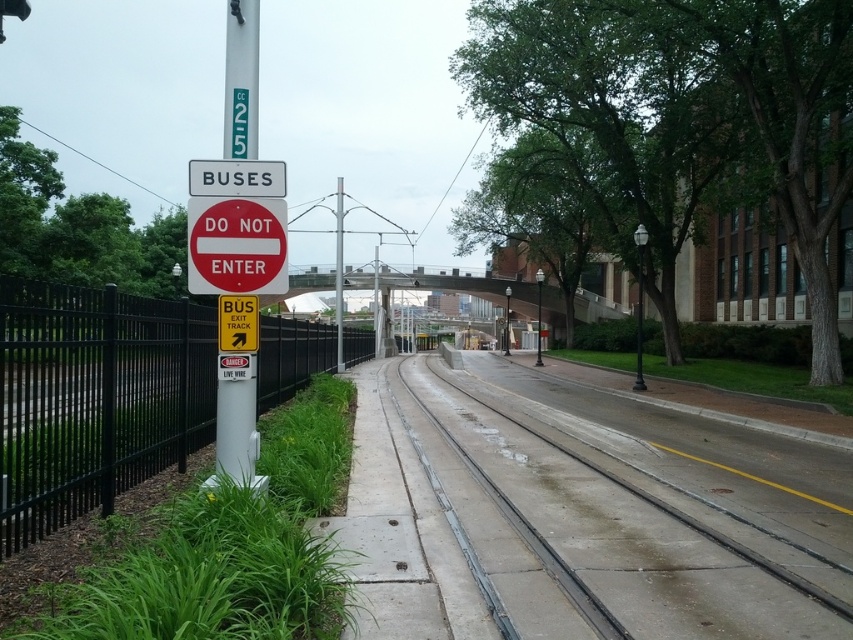
Which of these two, red matte do not enter sign at upper left or metallic pole at center, stands taller?

Standing taller between the two is metallic pole at center.

Which is in front, point (250, 275) or point (639, 298)?

Point (250, 275) is in front.

Is point (279, 228) farther from viewer compared to point (637, 324)?

No, it is in front of (637, 324).

Locate an element on the screen. red matte do not enter sign at upper left is located at coordinates (236, 244).

Between red matte do not enter sign at upper left and white plastic pole at center, which one is positioned lower?

white plastic pole at center is below.

Is red matte do not enter sign at upper left taller than white plastic pole at center?

No.

Which is behind, point (206, 228) or point (225, 106)?

Positioned behind is point (225, 106).

Where is `red matte do not enter sign at upper left`? red matte do not enter sign at upper left is located at coordinates (236, 244).

Who is positioned more to the right, smooth concrete track at center or red matte do not enter sign at upper left?

smooth concrete track at center is more to the right.

Can you confirm if smooth concrete track at center is bigger than red matte do not enter sign at upper left?

Indeed, smooth concrete track at center has a larger size compared to red matte do not enter sign at upper left.

Identify the location of smooth concrete track at center. (624, 524).